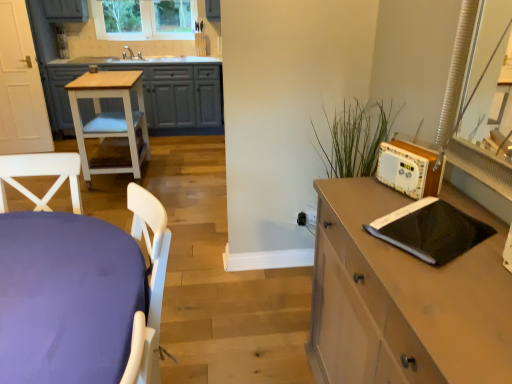
The height and width of the screenshot is (384, 512). What do you see at coordinates (430, 230) in the screenshot? I see `black matte notebook at right` at bounding box center [430, 230].

This screenshot has height=384, width=512. Find the location of `matte brown cabinet at right`. matte brown cabinet at right is located at coordinates (402, 300).

The width and height of the screenshot is (512, 384). Describe the element at coordinates (67, 298) in the screenshot. I see `purple fabric table at lower left` at that location.

Locate an element on the screen. The image size is (512, 384). white painted wood cabinet at left is located at coordinates (152, 92).

This screenshot has width=512, height=384. I want to click on black matte notebook at right, so click(430, 230).

Locate an element on the screen. chest of drawers located on the right of light wood/white painted stool at left is located at coordinates (402, 300).

Which object is closer to the camera, light wood/white painted stool at left or matte brown cabinet at right?

matte brown cabinet at right is closer to the camera.

Based on their sizes in the image, would you say light wood/white painted stool at left is bigger or smaller than matte brown cabinet at right?

Clearly, light wood/white painted stool at left is smaller in size than matte brown cabinet at right.

Considering the sizes of matte brown cabinet at right and purple fabric table at lower left in the image, is matte brown cabinet at right taller or shorter than purple fabric table at lower left?

matte brown cabinet at right is taller than purple fabric table at lower left.

Can you tell me how much matte brown cabinet at right and purple fabric table at lower left differ in facing direction?

90.5 degrees.

Considering the relative sizes of matte brown cabinet at right and purple fabric table at lower left in the image provided, is matte brown cabinet at right bigger than purple fabric table at lower left?

No, matte brown cabinet at right is not bigger than purple fabric table at lower left.

Would you say matte brown cabinet at right is inside or outside purple fabric table at lower left?

The correct answer is: outside.

Between light wood/white painted stool at left and wooden radio at right, which one has smaller size?

Smaller between the two is wooden radio at right.

Between light wood/white painted stool at left and wooden radio at right, which one has smaller width?

wooden radio at right is thinner.

Can you confirm if clear glass window at upper center is positioned to the right of wooden radio at right?

In fact, clear glass window at upper center is to the left of wooden radio at right.

From the image's perspective, between clear glass window at upper center and wooden radio at right, which one is located above?

clear glass window at upper center is shown above in the image.

From a real-world perspective, which is physically below, clear glass window at upper center or wooden radio at right?

From a 3D spatial view, wooden radio at right is below.

Find the location of a particular element. This screenshot has height=384, width=512. window located above the wooden radio at right (from a real-world perspective) is located at coordinates (144, 19).

Is black matte notebook at right completely or partially outside of purple fabric table at lower left?

Yes, black matte notebook at right is located beyond the bounds of purple fabric table at lower left.

What's the angular difference between black matte notebook at right and purple fabric table at lower left's facing directions?

black matte notebook at right and purple fabric table at lower left are facing 123 degrees away from each other.

Does black matte notebook at right come behind purple fabric table at lower left?

Yes.

Does point (484, 239) come behind point (128, 236)?

No, (484, 239) is in front of (128, 236).

Consider the image. Is white painted wood cabinet at left turned away from black matte notebook at right?

No, black matte notebook at right is not at the back of white painted wood cabinet at left.

Considering the relative positions of white painted wood cabinet at left and black matte notebook at right in the image provided, is white painted wood cabinet at left to the right of black matte notebook at right from the viewer's perspective?

No, white painted wood cabinet at left is not to the right of black matte notebook at right.

Considering the sizes of white painted wood cabinet at left and black matte notebook at right in the image, is white painted wood cabinet at left taller or shorter than black matte notebook at right?

Considering their sizes, white painted wood cabinet at left has more height than black matte notebook at right.

In the scene shown: Is white painted wood cabinet at left not within black matte notebook at right?

Yes, white painted wood cabinet at left is outside of black matte notebook at right.

How many degrees apart are the facing directions of purple fabric table at lower left and black matte notebook at right?

purple fabric table at lower left and black matte notebook at right are facing 123 degrees away from each other.

Does purple fabric table at lower left have a larger size compared to black matte notebook at right?

Correct, purple fabric table at lower left is larger in size than black matte notebook at right.

From the image's perspective, is purple fabric table at lower left located above black matte notebook at right?

No.

I want to click on table on the left of matte brown cabinet at right, so pos(110,118).

Where is `chest of drawers above the purple fabric table at lower left (from a real-world perspective)`? chest of drawers above the purple fabric table at lower left (from a real-world perspective) is located at coordinates (402, 300).

Estimate the real-world distances between objects in this image. Which object is further from purple fabric table at lower left, clear glass window at upper center or light wood/white painted stool at left?

clear glass window at upper center.

Which object lies nearer to the anchor point clear glass window at upper center, black matte notebook at right or wooden radio at right?

wooden radio at right.

From the image, which object appears to be nearer to light wood/white painted stool at left, white painted wood cabinet at left or purple fabric table at lower left?

white painted wood cabinet at left is positioned closer to the anchor light wood/white painted stool at left.

Estimate the real-world distances between objects in this image. Which object is further from white painted wood cabinet at left, black matte notebook at right or clear glass window at upper center?

Among the two, black matte notebook at right is located further to white painted wood cabinet at left.

Considering their positions, is clear glass window at upper center positioned further to white painted wood cabinet at left than purple fabric table at lower left?

purple fabric table at lower left is positioned further to the anchor white painted wood cabinet at left.

Which object lies further to the anchor point purple fabric table at lower left, white painted wood cabinet at left or wooden radio at right?

Based on the image, white painted wood cabinet at left appears to be further to purple fabric table at lower left.

Considering their positions, is purple fabric table at lower left positioned further to black matte notebook at right than matte brown cabinet at right?

Among the two, purple fabric table at lower left is located further to black matte notebook at right.

When comparing their distances from wooden radio at right, does purple fabric table at lower left or white painted wood cabinet at left seem further?

Based on the image, white painted wood cabinet at left appears to be further to wooden radio at right.

The image size is (512, 384). Find the location of `pad positioned between purple fabric table at lower left and clear glass window at upper center from near to far`. pad positioned between purple fabric table at lower left and clear glass window at upper center from near to far is located at coordinates (430, 230).

Locate an element on the screen. The width and height of the screenshot is (512, 384). cabinetry between matte brown cabinet at right and clear glass window at upper center from front to back is located at coordinates pos(152,92).

Where is `appliance between black matte notebook at right and light wood/white painted stool at left in the front-back direction`? appliance between black matte notebook at right and light wood/white painted stool at left in the front-back direction is located at coordinates (409, 169).

The height and width of the screenshot is (384, 512). I want to click on pad between purple fabric table at lower left and light wood/white painted stool at left in the front-back direction, so click(430, 230).